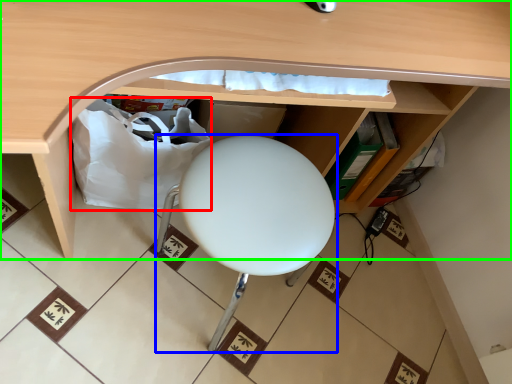
Question: Estimate the real-world distances between objects in this image. Which object is closer to paper bag (highlighted by a red box), furniture (highlighted by a blue box) or desk (highlighted by a green box)?

Choices:
 (A) furniture
 (B) desk

Answer: (A)